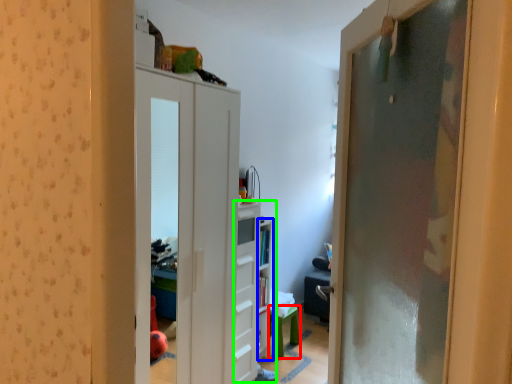
Question: Which object is the farthest from furniture (highlighted by a red box)? Choose among these: shelf (highlighted by a blue box) or dresser (highlighted by a green box).

Choices:
 (A) shelf
 (B) dresser

Answer: (B)